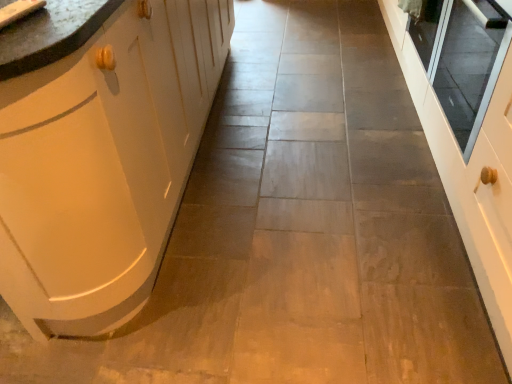
Question: Does matte white sink at upper left have a larger size compared to matte white cabinet at left?

Choices:
 (A) no
 (B) yes

Answer: (A)

Question: Is matte white sink at upper left in front of matte white cabinet at left?

Choices:
 (A) no
 (B) yes

Answer: (A)

Question: Does matte white sink at upper left lie behind matte white cabinet at left?

Choices:
 (A) yes
 (B) no

Answer: (A)

Question: Is matte white sink at upper left thinner than matte white cabinet at left?

Choices:
 (A) no
 (B) yes

Answer: (B)

Question: Considering the relative sizes of matte white sink at upper left and matte white cabinet at left in the image provided, is matte white sink at upper left wider than matte white cabinet at left?

Choices:
 (A) yes
 (B) no

Answer: (B)

Question: From the image's perspective, is matte white sink at upper left above or below transparent glass door at right?

Choices:
 (A) above
 (B) below

Answer: (B)

Question: Is matte white sink at upper left situated inside transparent glass door at right or outside?

Choices:
 (A) inside
 (B) outside

Answer: (B)

Question: Is point [40, 3] closer or farther from the camera than point [457, 127]?

Choices:
 (A) closer
 (B) farther

Answer: (A)

Question: Is matte white sink at upper left taller or shorter than transparent glass door at right?

Choices:
 (A) short
 (B) tall

Answer: (A)

Question: Based on their positions, is transparent glass door at right located to the left or right of matte white cabinet at left?

Choices:
 (A) right
 (B) left

Answer: (A)

Question: Is transparent glass door at right taller or shorter than matte white cabinet at left?

Choices:
 (A) tall
 (B) short

Answer: (B)

Question: Is transparent glass door at right spatially inside matte white cabinet at left, or outside of it?

Choices:
 (A) outside
 (B) inside

Answer: (A)

Question: In the image, is transparent glass door at right positioned in front of or behind matte white cabinet at left?

Choices:
 (A) front
 (B) behind

Answer: (B)

Question: Considering the positions of matte white cabinet at left and transparent glass door at right in the image, is matte white cabinet at left wider or thinner than transparent glass door at right?

Choices:
 (A) thin
 (B) wide

Answer: (B)

Question: Is matte white cabinet at left taller or shorter than transparent glass door at right?

Choices:
 (A) short
 (B) tall

Answer: (B)